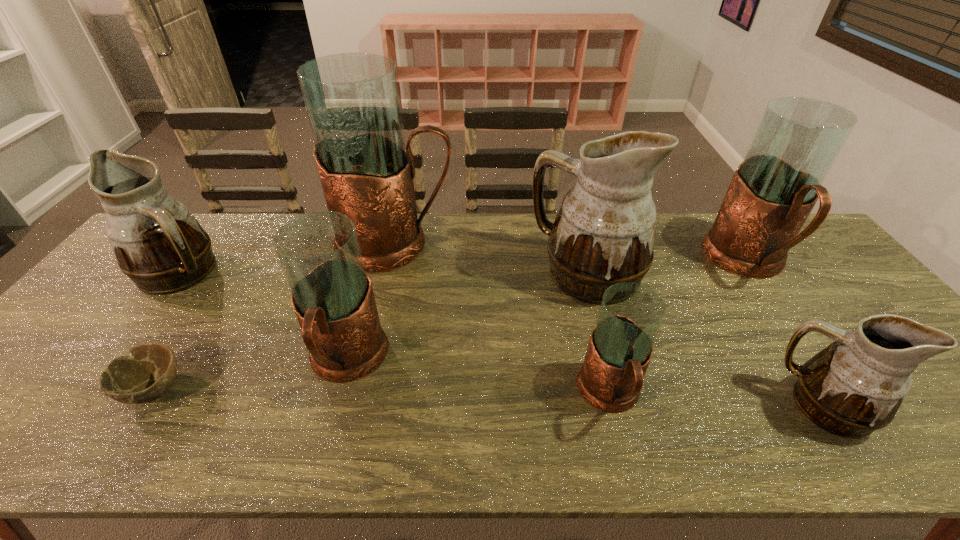
At what (x,y) coordinates should I click in order to perform the action: click on bowl. Please return your answer as a coordinate pair (x, y). Image resolution: width=960 pixels, height=540 pixels. Looking at the image, I should click on (150, 371).

Find the location of a particular element. This screenshot has height=540, width=960. vacant region located 0.120m with the handle on the side of the tallest pitcher is located at coordinates (492, 244).

Find the location of a particular element. This screenshot has width=960, height=540. free space located 0.110m with the handle on the side of the rightmost gray pitcher is located at coordinates (794, 328).

Locate an element on the screen. The width and height of the screenshot is (960, 540). vacant space located from the spout of the second brown pitcher from right to left is located at coordinates (425, 274).

Where is `free region located from the spout of the second brown pitcher from right to left`? The width and height of the screenshot is (960, 540). free region located from the spout of the second brown pitcher from right to left is located at coordinates (412, 274).

Locate an element on the screen. This screenshot has width=960, height=540. free region located 0.100m from the spout of the second brown pitcher from right to left is located at coordinates (496, 274).

You are a GUI agent. You are given a task and a screenshot of the screen. Output one action in this format:
    pyautogui.click(x=<x>, y=<y>)
    Task: Click on the free location located 0.200m from the spout of the leftmost pitcher
    The width and height of the screenshot is (960, 540).
    Given the screenshot: What is the action you would take?
    pyautogui.click(x=296, y=272)

Where is `vacant point located with the handle on the side of the third biggest gray pitcher`? This screenshot has width=960, height=540. vacant point located with the handle on the side of the third biggest gray pitcher is located at coordinates (328, 429).

I want to click on free space located with the handle on the side of the second gray pitcher from right to left, so click(x=626, y=457).

Where is `vacant space located 0.320m from the spout of the nearest brown pitcher`? This screenshot has height=540, width=960. vacant space located 0.320m from the spout of the nearest brown pitcher is located at coordinates (636, 406).